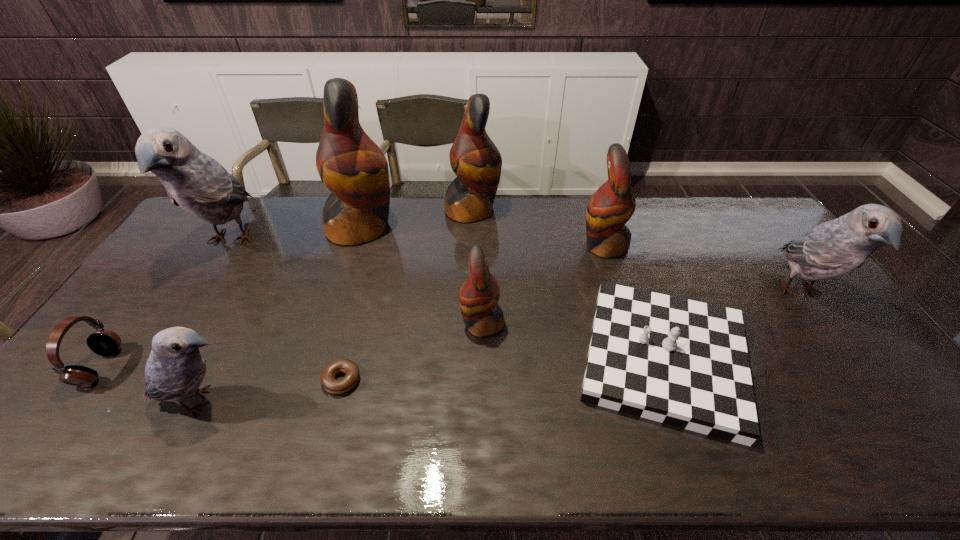
Find the location of a particular element. The image size is (960, 540). free space located on the back of the doughnut is located at coordinates (360, 310).

Identify the location of object located at the near edge. (681, 362).

Locate an element on the screen. parrot located at the left edge is located at coordinates coord(199,184).

Locate an element on the screen. The image size is (960, 540). headset that is at the left edge is located at coordinates (103, 342).

Locate an element on the screen. object that is at the right edge is located at coordinates (836, 247).

The width and height of the screenshot is (960, 540). Find the location of `object situated at the far left corner`. object situated at the far left corner is located at coordinates point(199,184).

In the image, there is a desktop. Where is `free space at the far edge`? This screenshot has width=960, height=540. free space at the far edge is located at coordinates (519, 229).

In the image, there is a desktop. What are the coordinates of `free space at the near edge` in the screenshot? It's located at (367, 442).

Locate an element on the screen. The height and width of the screenshot is (540, 960). vacant space at the left edge is located at coordinates (183, 279).

In the image, there is a desktop. Where is `free space at the far right corner`? free space at the far right corner is located at coordinates (753, 204).